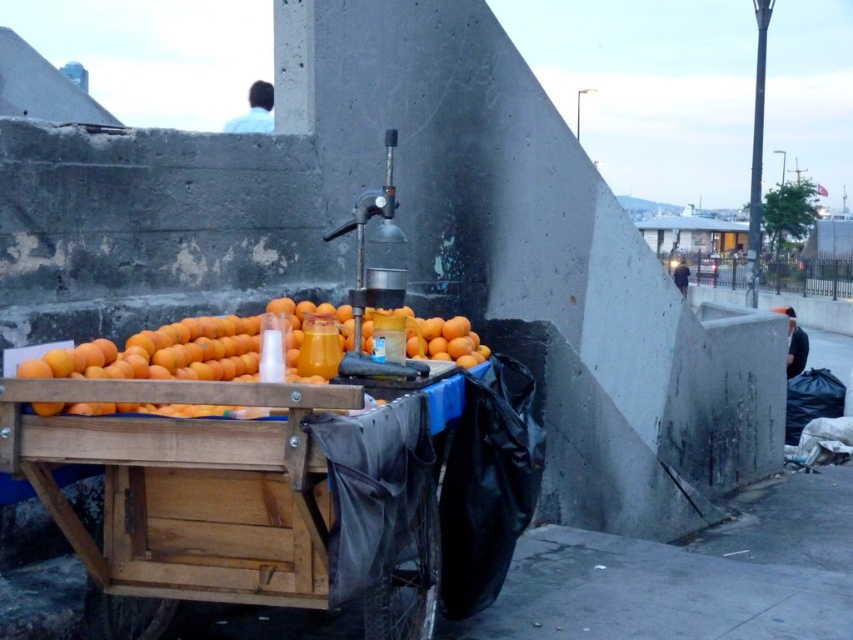
Can you confirm if light blue shirt at upper center is positioned above dark blue shirt at lower right?

Correct, light blue shirt at upper center is located above dark blue shirt at lower right.

Does light blue shirt at upper center have a smaller size compared to dark blue shirt at lower right?

Actually, light blue shirt at upper center might be larger than dark blue shirt at lower right.

Locate an element on the screen. The width and height of the screenshot is (853, 640). light blue shirt at upper center is located at coordinates (254, 112).

Does light blue shirt at upper center have a smaller size compared to dark blue fabric at right?

Incorrect, light blue shirt at upper center is not smaller in size than dark blue fabric at right.

Can you confirm if light blue shirt at upper center is positioned to the right of dark blue fabric at right?

No, light blue shirt at upper center is not to the right of dark blue fabric at right.

Which is behind, point (256, 93) or point (682, 278)?

Positioned behind is point (682, 278).

Find the location of `light blue shirt at upper center`. light blue shirt at upper center is located at coordinates (254, 112).

Who is positioned more to the left, wooden cart at lower left or dark blue fabric at right?

wooden cart at lower left is more to the left.

Which is behind, point (407, 570) or point (686, 292)?

Positioned behind is point (686, 292).

The image size is (853, 640). What are the coordinates of `wooden cart at lower left` in the screenshot? It's located at (184, 515).